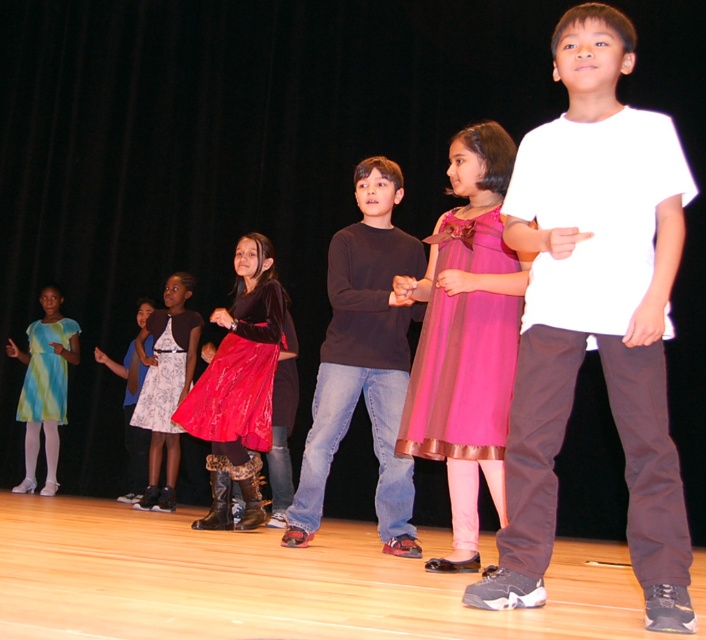
You are a photographer trying to capture a group photo of the children on stage. You notice two central items of clothing, the white cotton shirt at center and the dark gray sweater at center. Which clothing item is positioned to the right of the other?

The white cotton shirt at center is positioned on the right side of dark gray sweater at center.

You are a photographer positioned at the back of the stage. You need to capture a photo that includes both the white cotton shirt at center and the dark gray sweater at center. Based on their positions, which one should you focus on first to ensure both are in frame?

The white cotton shirt at center is located above the dark gray sweater at center, so you should focus on the dark gray sweater at center first to ensure both are in frame.